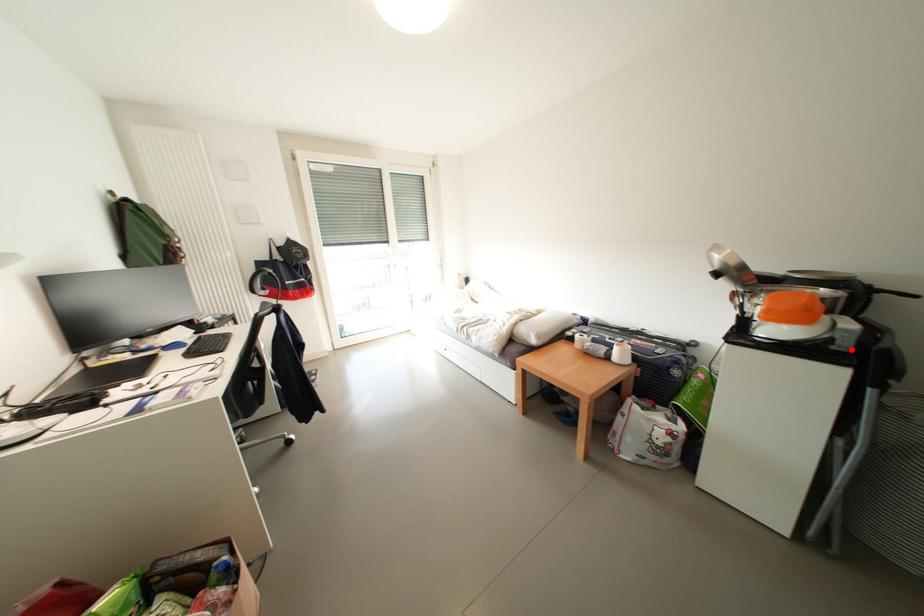
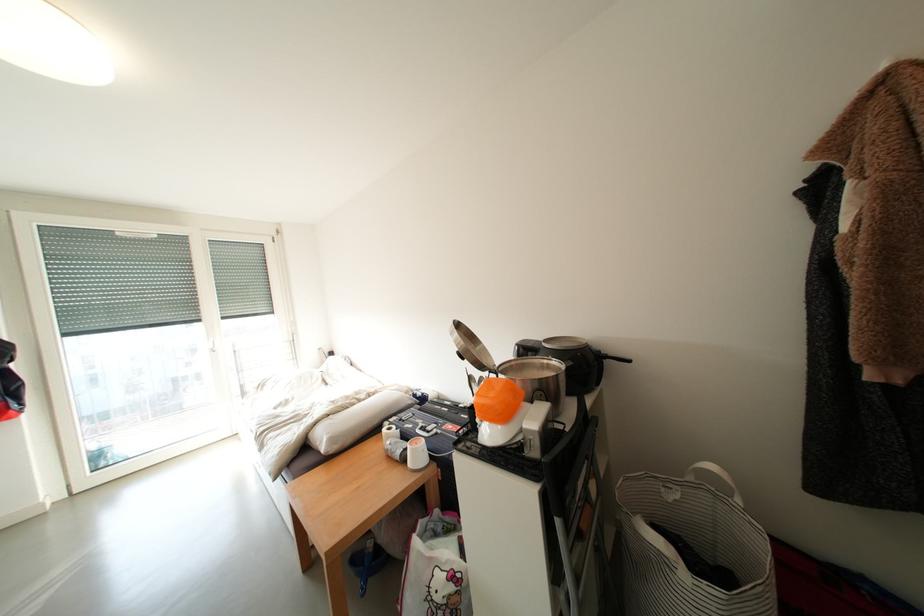
Find the pixel in the second image that matches the highlighted location in the first image.

(541, 455)